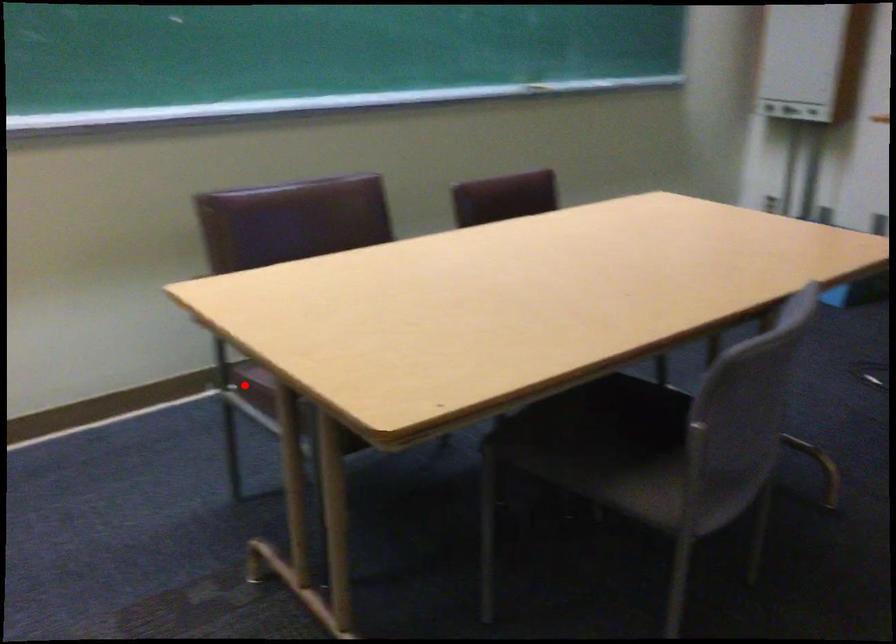
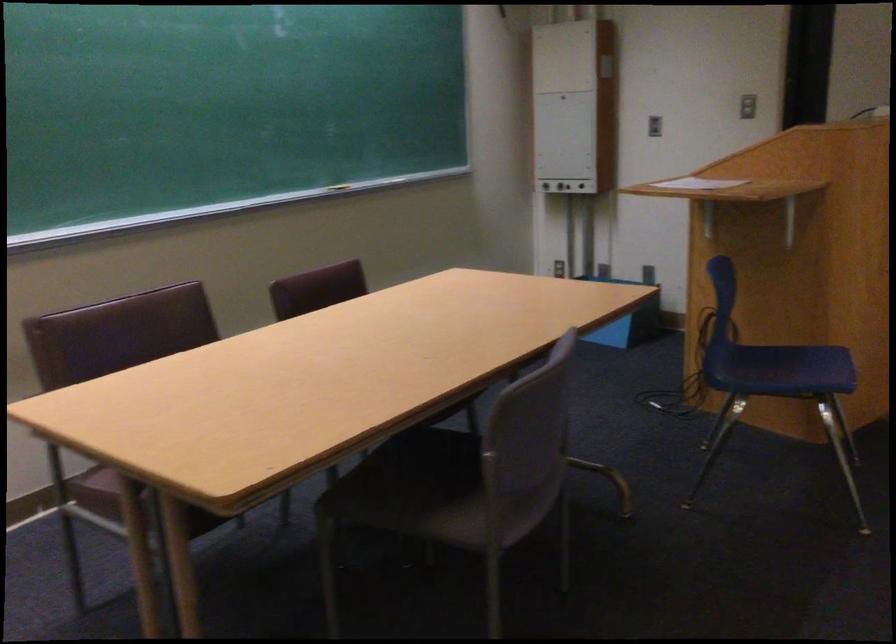
Where in the second image is the point corresponding to the highlighted location from the first image?

(96, 491)